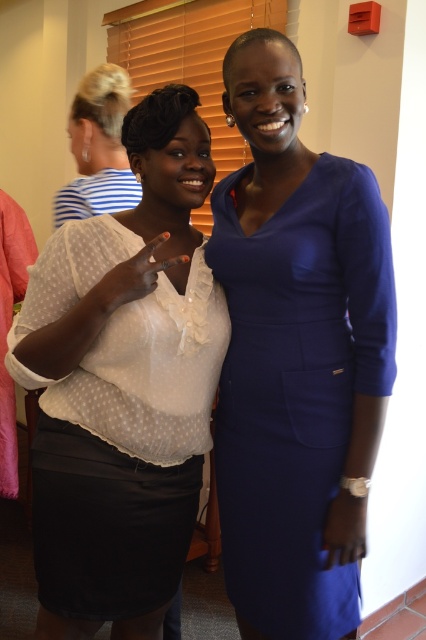
Question: Does white dotted blouse at center appear over blonde hair at upper left?

Choices:
 (A) yes
 (B) no

Answer: (B)

Question: Which object is the farthest from the blonde hair at upper left?

Choices:
 (A) satin blue dress at center
 (B) white dotted blouse at center

Answer: (A)

Question: Among these objects, which one is nearest to the camera?

Choices:
 (A) blonde hair at upper left
 (B) satin blue dress at center
 (C) white dotted blouse at center

Answer: (B)

Question: Which point is closer to the camera taking this photo?

Choices:
 (A) (121, 92)
 (B) (342, 285)
 (C) (124, 538)

Answer: (B)

Question: Is white dotted blouse at center smaller than blonde hair at upper left?

Choices:
 (A) yes
 (B) no

Answer: (B)

Question: In this image, where is satin blue dress at center located relative to blonde hair at upper left?

Choices:
 (A) below
 (B) above

Answer: (A)